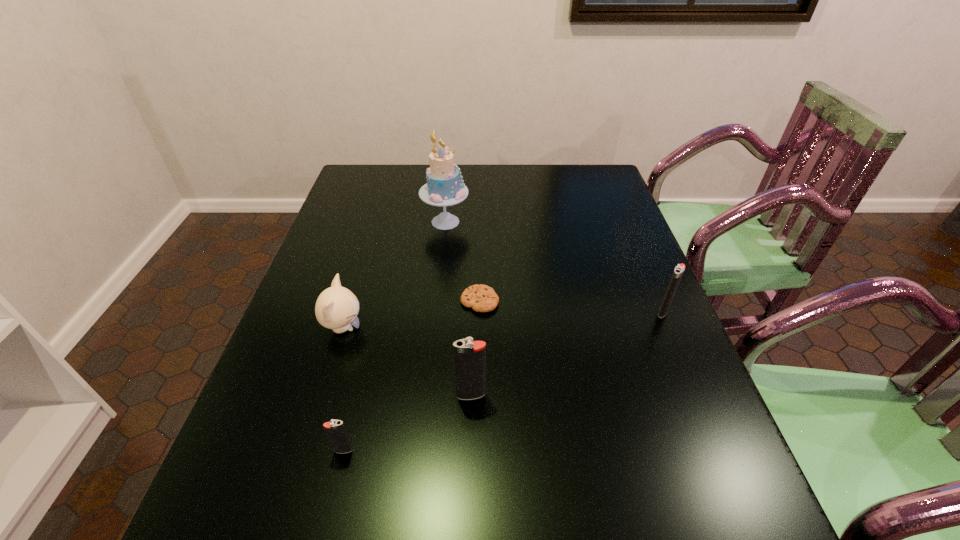
You are a GUI agent. You are given a task and a screenshot of the screen. Output one action in this format:
    pyautogui.click(x=<x>, y=<y>)
    Task: Click on the nearest object
    Image resolution: width=960 pixels, height=540 pixels.
    Given the screenshot: What is the action you would take?
    pyautogui.click(x=336, y=432)

What are the coordinates of `the fifth object from right to left` in the screenshot? It's located at (336, 432).

You are a GUI agent. You are given a task and a screenshot of the screen. Output one action in this format:
    pyautogui.click(x=<x>, y=<y>)
    Task: Click on the second farthest igniter
    This screenshot has width=960, height=540.
    Given the screenshot: What is the action you would take?
    pyautogui.click(x=469, y=356)

Identify the location of the second nearest object. (469, 356).

Find the location of `the second tallest igniter`. the second tallest igniter is located at coordinates (679, 269).

Where is `the farthest igniter`? Image resolution: width=960 pixels, height=540 pixels. the farthest igniter is located at coordinates (679, 269).

Locate an element on the screen. the fourth tallest object is located at coordinates (336, 308).

Where is `the leftmost object`? The height and width of the screenshot is (540, 960). the leftmost object is located at coordinates (336, 308).

This screenshot has height=540, width=960. What are the coordinates of `cake` in the screenshot? It's located at (445, 187).

This screenshot has height=540, width=960. Identify the location of the tallest object. (445, 187).